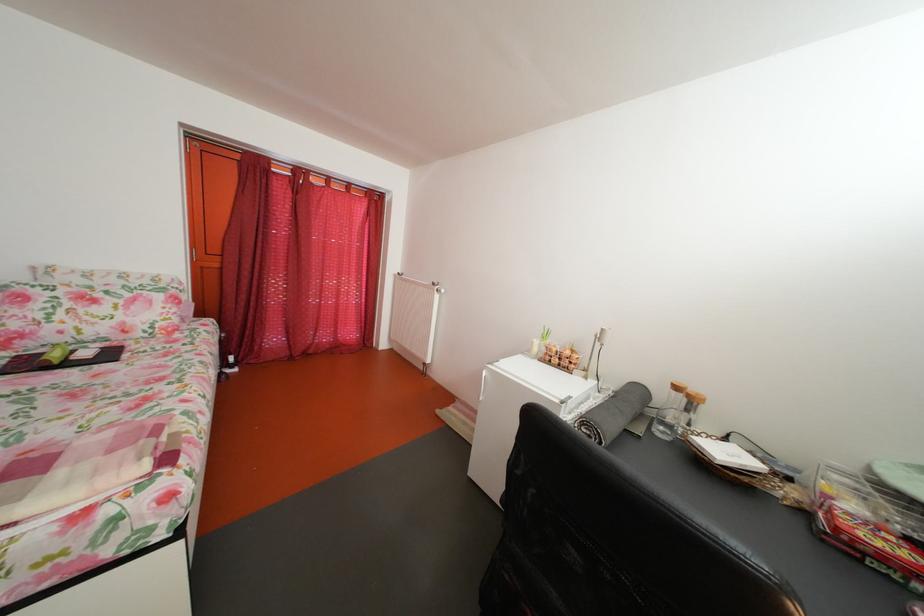
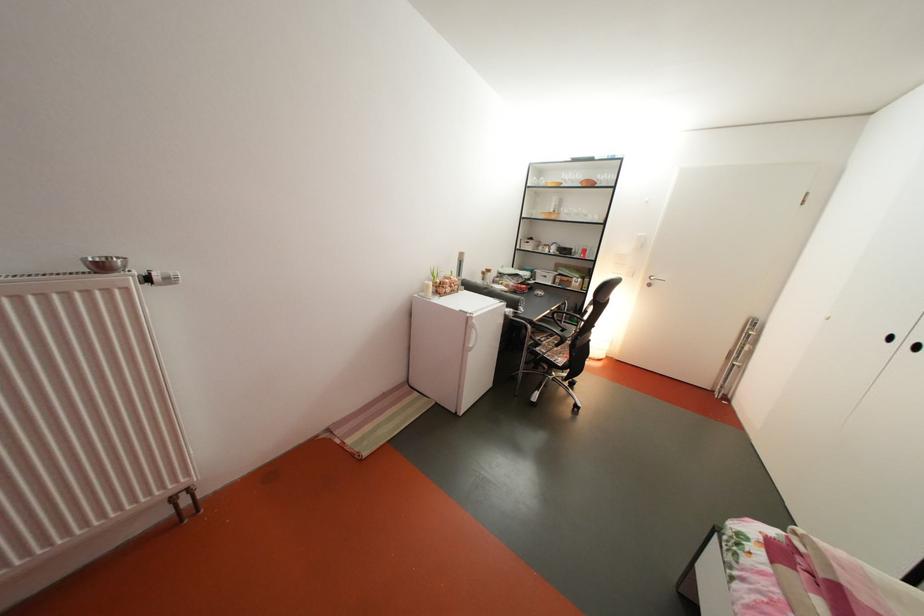
Where in the second image is the point corresponding to point (543, 350) from the first image?

(439, 293)